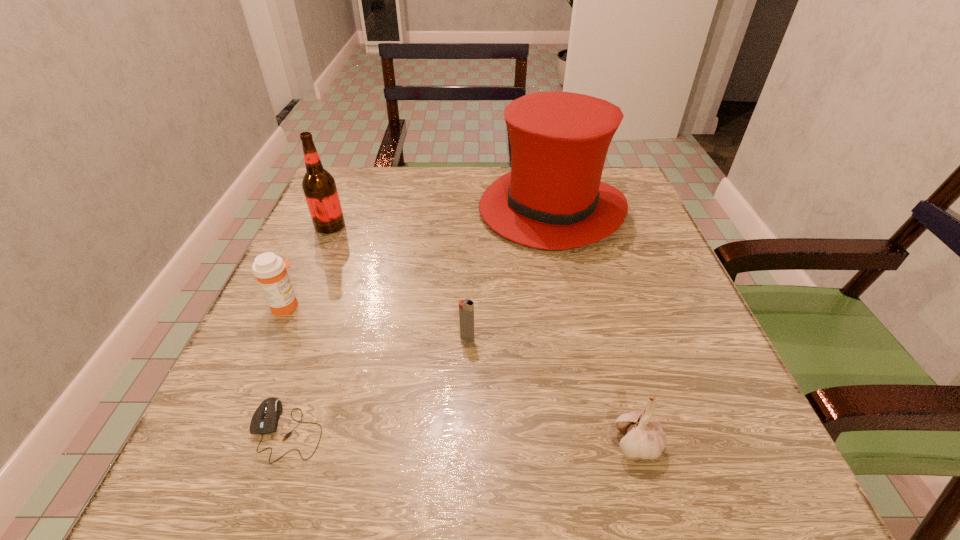
Find the location of `vacant space at the right edge`. vacant space at the right edge is located at coordinates pos(626,255).

The height and width of the screenshot is (540, 960). What are the coordinates of `vacant space in between the igniter and the computer mouse` in the screenshot? It's located at (377, 384).

Where is `empty space that is in between the computer mouse and the garlic`? The width and height of the screenshot is (960, 540). empty space that is in between the computer mouse and the garlic is located at coordinates (462, 436).

Locate an element on the screen. The image size is (960, 540). free space that is in between the computer mouse and the garlic is located at coordinates (462, 436).

Image resolution: width=960 pixels, height=540 pixels. What are the coordinates of `free spot between the root beer and the third tallest object` in the screenshot? It's located at (308, 266).

This screenshot has width=960, height=540. Find the location of `empty space that is in between the root beer and the computer mouse`. empty space that is in between the root beer and the computer mouse is located at coordinates (309, 328).

The image size is (960, 540). I want to click on vacant area that lies between the garlic and the third nearest object, so click(x=552, y=391).

This screenshot has width=960, height=540. I want to click on free space between the shortest object and the garlic, so click(x=462, y=436).

The height and width of the screenshot is (540, 960). In order to click on unoccupied area between the fourth shortest object and the garlic in this screenshot , I will do `click(462, 375)`.

What are the coordinates of `empty space between the root beer and the garlic` in the screenshot? It's located at (484, 334).